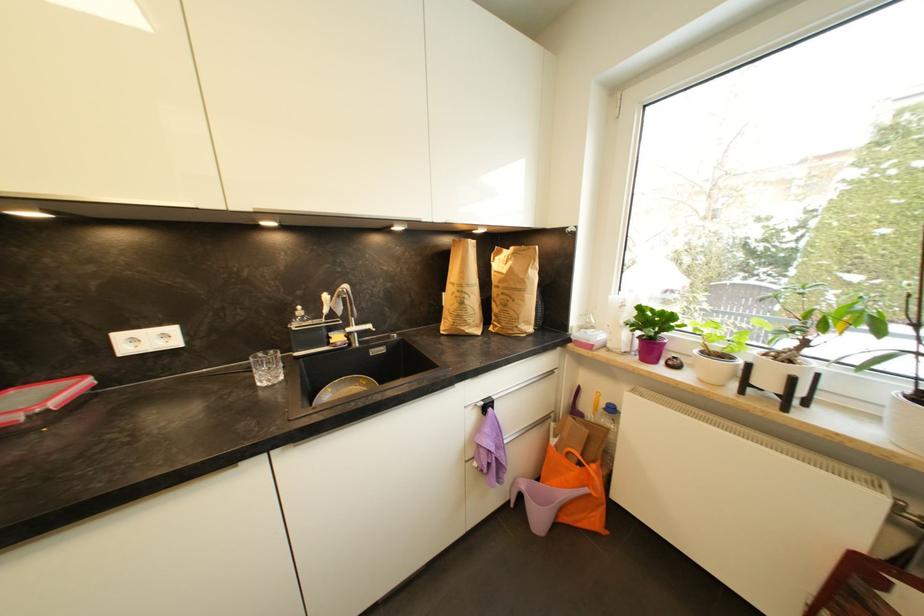
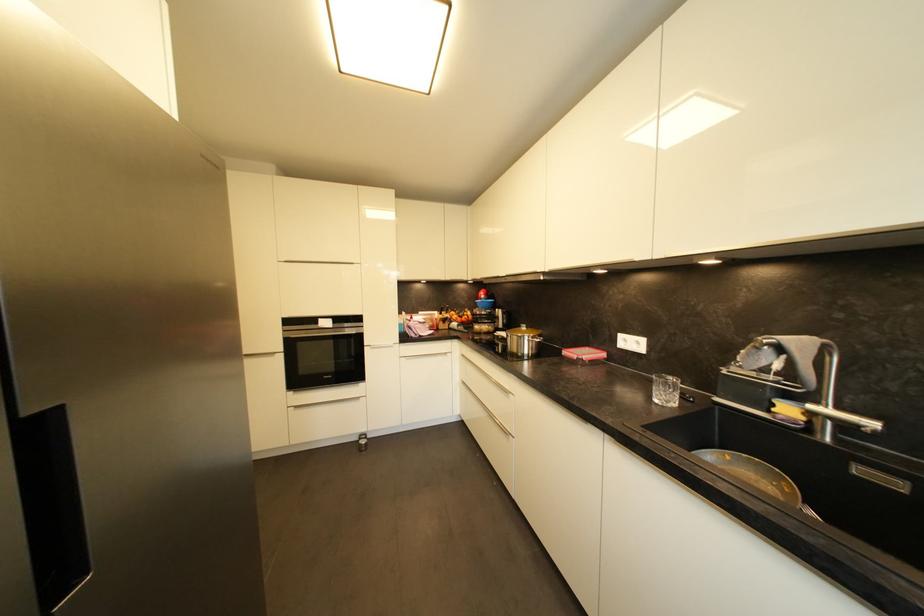
Where in the second image is the point corresponding to (169,338) from the first image?

(642, 345)